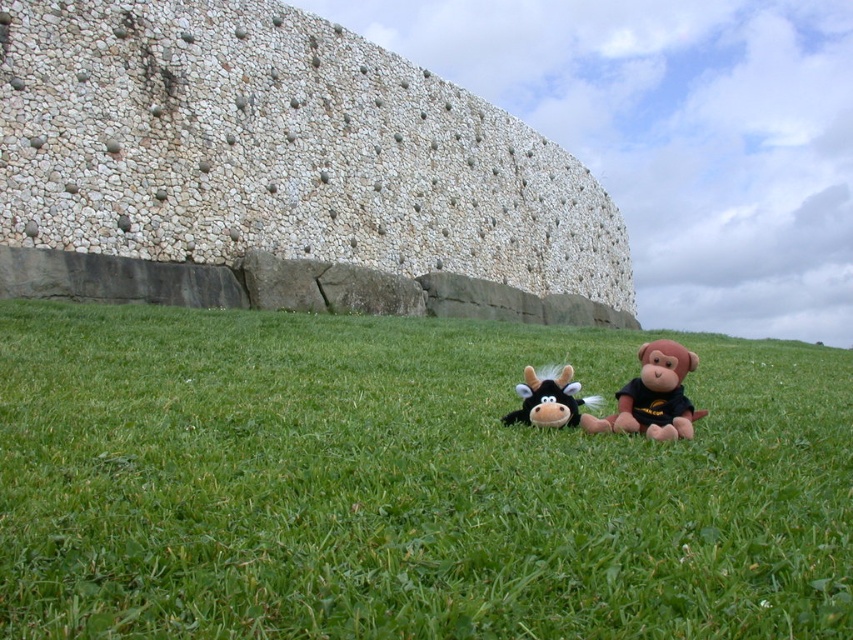
Between green grass at center and white stonework at center, which one has more height?

With more height is white stonework at center.

Describe the element at coordinates (404, 483) in the screenshot. The image size is (853, 640). I see `green grass at center` at that location.

Where is `green grass at center`? The image size is (853, 640). green grass at center is located at coordinates (404, 483).

Who is more forward, [630,417] or [549,410]?

Point [630,417]

Does brown plush monkey at lower right appear on the left side of black plush cow at center?

In fact, brown plush monkey at lower right is to the right of black plush cow at center.

The image size is (853, 640). I want to click on brown plush monkey at lower right, so click(653, 396).

Can you confirm if green grass at center is bigger than brown plush monkey at lower right?

Yes.

Measure the distance from green grass at center to brown plush monkey at lower right.

green grass at center is 20.66 feet from brown plush monkey at lower right.

Does point (697, 340) come closer to viewer compared to point (666, 419)?

That is False.

The width and height of the screenshot is (853, 640). In order to click on green grass at center in this screenshot , I will do `click(404, 483)`.